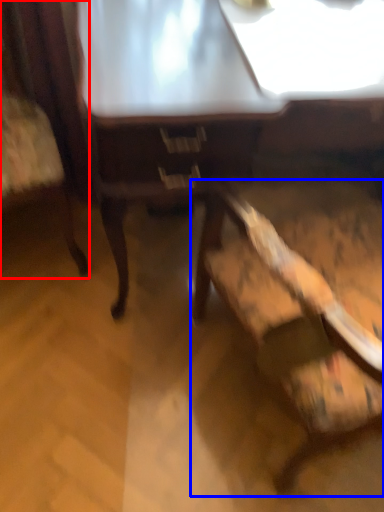
Question: Which of the following is the closest to the observer, chair (highlighted by a red box) or chair (highlighted by a blue box)?

Choices:
 (A) chair
 (B) chair

Answer: (B)